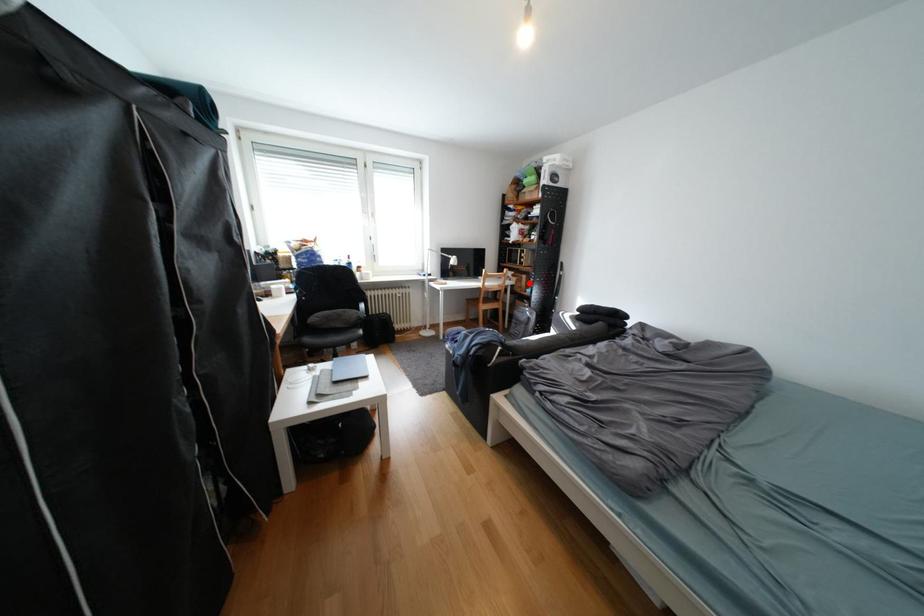
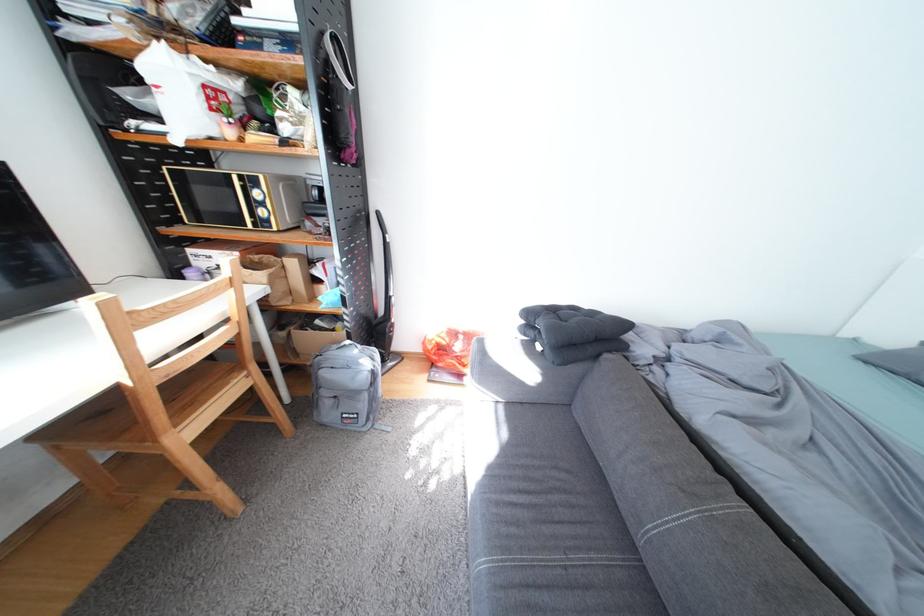
Where in the second image is the point corresponding to the highlighted location from the first image?

(285, 284)